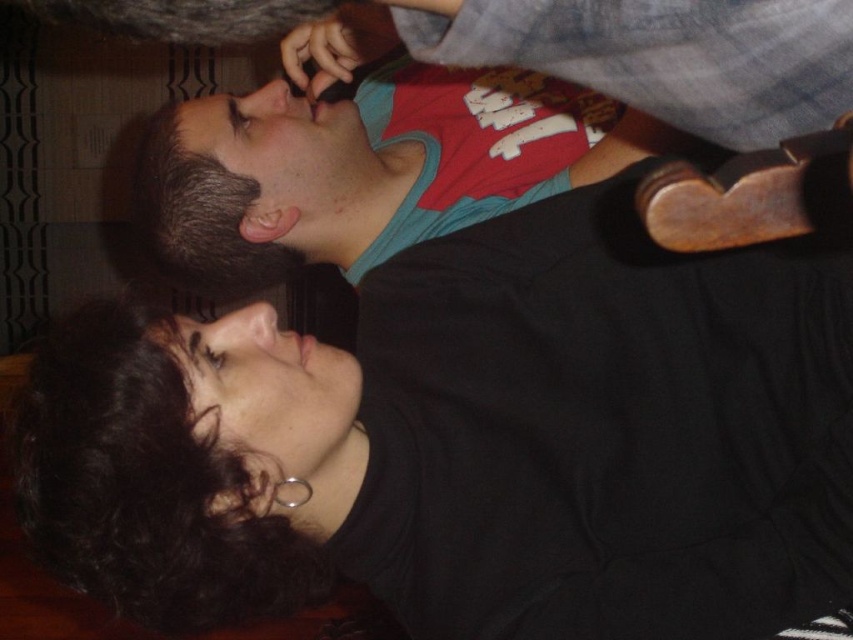
You are a photographer trying to capture a clear shot of both the black matte shirt at upper center and the matte green head at upper center in the scene. Based on their sizes, which one should you focus on first to ensure it fits within the frame?

The black matte shirt at upper center has a larger size compared to matte green head at upper center, so you should focus on the black matte shirt at upper center first to ensure it fits within the frame.

You are a photographer standing in front of the scene. You want to take a closeup shot of the black matte shirt at upper center. What is the minimum distance you need to maintain to ensure the subject is in focus?

The black matte shirt at upper center is 21.33 inches from viewer, so you need to maintain at least 21.33 inches distance to ensure it is in focus.